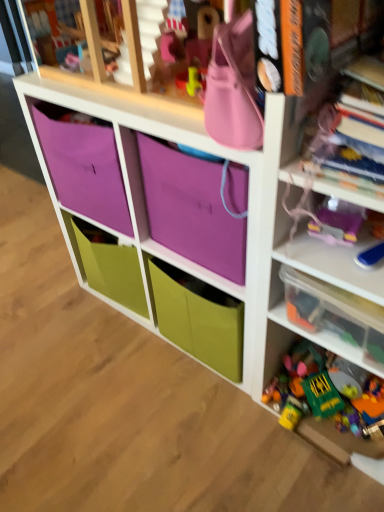
Find the location of a particular element. The width and height of the screenshot is (384, 512). vacant area on top of purple fabric storage at center (from a real-world perspective) is located at coordinates (132, 90).